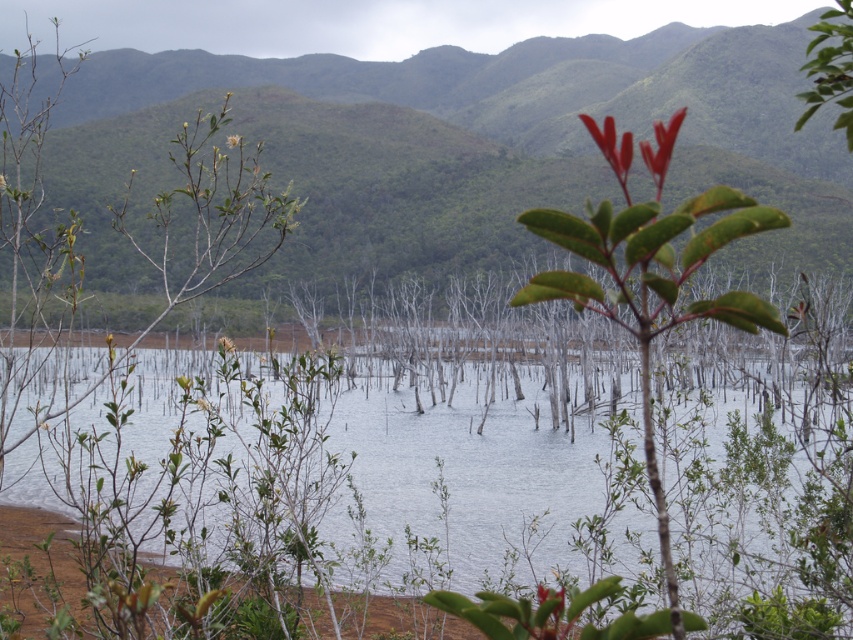
Question: Considering the relative positions of glossy red leaves at upper center and yellow textured flower at center in the image provided, where is glossy red leaves at upper center located with respect to yellow textured flower at center?

Choices:
 (A) below
 (B) above

Answer: (B)

Question: Does glossy red leaves at upper center have a smaller size compared to green matte flower at upper left?

Choices:
 (A) no
 (B) yes

Answer: (A)

Question: Which object is farther from the camera taking this photo?

Choices:
 (A) smooth glossy red flower at center
 (B) green leafy mountain at upper center
 (C) clear water at center
 (D) green matte flower at upper left

Answer: (B)

Question: Which of the following is the farthest from the observer?

Choices:
 (A) (656, 140)
 (B) (627, 152)

Answer: (A)

Question: From the image, what is the correct spatial relationship of clear water at center in relation to shiny red leaf at upper right?

Choices:
 (A) left
 (B) right

Answer: (A)

Question: Among these objects, which one is nearest to the camera?

Choices:
 (A) glossy red flower at upper right
 (B) green matte flower at upper center

Answer: (A)